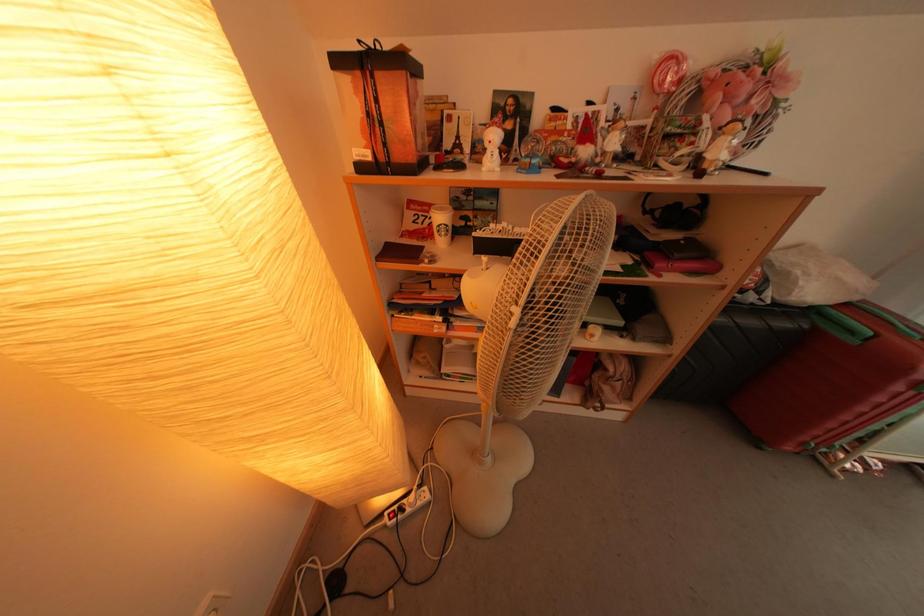
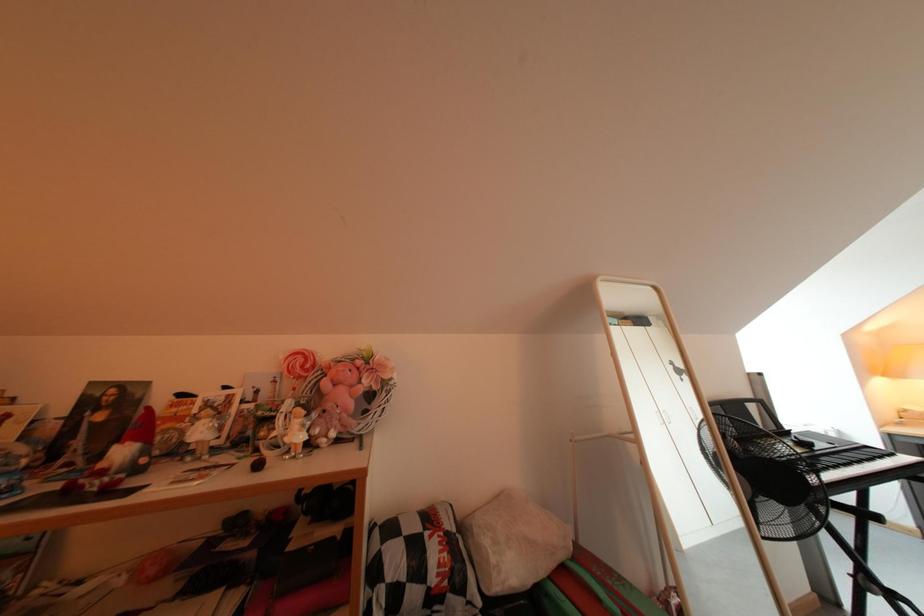
The first image is from the beginning of the video and the second image is from the end. How did the camera likely rotate when shooting the video?

The camera's rotation is toward right-up.